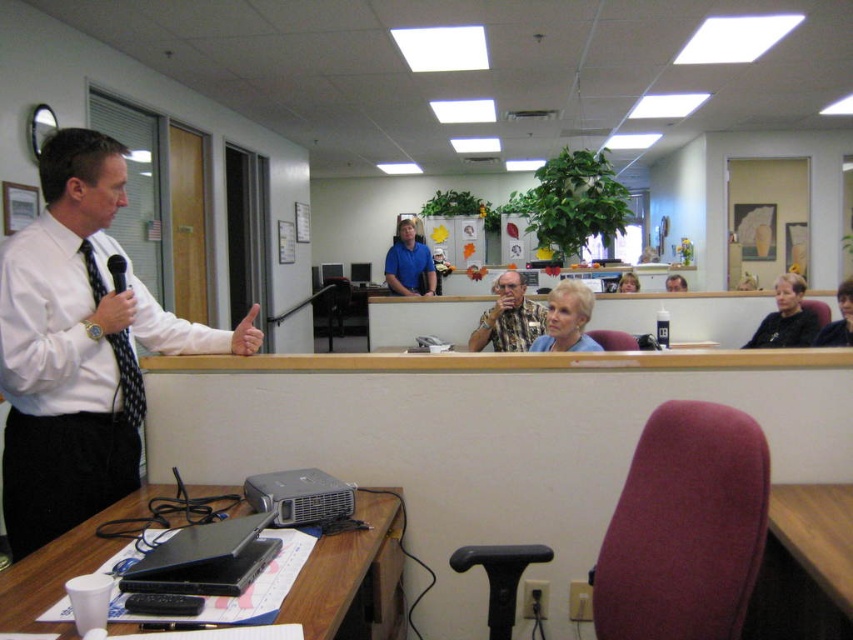
In the scene shown: Does black plastic table at lower left appear on the right side of blue shirt at center?

Correct, you'll find black plastic table at lower left to the right of blue shirt at center.

Does point (312, 634) come in front of point (430, 259)?

Yes.

What do you see at coordinates (352, 577) in the screenshot?
I see `black plastic table at lower left` at bounding box center [352, 577].

Locate an element on the screen. Image resolution: width=853 pixels, height=640 pixels. black plastic table at lower left is located at coordinates coord(352,577).

Which is below, matte blue blouse at center or black fabric chair at right?

black fabric chair at right is below.

Does matte blue blouse at center have a greater height compared to black fabric chair at right?

No.

Is point (572, 294) closer to camera compared to point (799, 333)?

That is True.

Where is `matte blue blouse at center`? The width and height of the screenshot is (853, 640). matte blue blouse at center is located at coordinates (567, 320).

Is point (10, 596) in front of point (587, 337)?

Yes.

Based on the photo, can you confirm if black plastic table at lower left is smaller than matte blue blouse at center?

Yes, black plastic table at lower left is smaller than matte blue blouse at center.

Which is in front, point (326, 579) or point (569, 307)?

Point (326, 579) is in front.

The width and height of the screenshot is (853, 640). I want to click on black plastic table at lower left, so click(x=352, y=577).